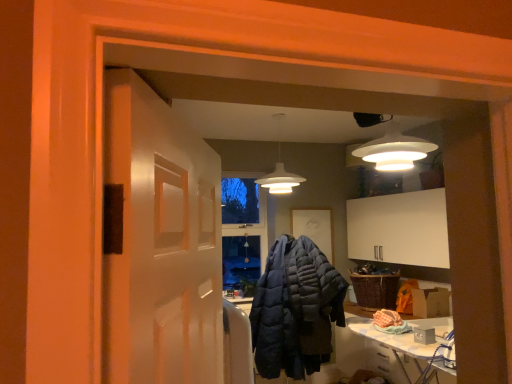
Question: Is white ironing board at lower right not close to woven brown basket at lower right?

Choices:
 (A) yes
 (B) no

Answer: (B)

Question: Can you confirm if white ironing board at lower right is positioned to the right of woven brown basket at lower right?

Choices:
 (A) no
 (B) yes

Answer: (B)

Question: Considering the relative sizes of white ironing board at lower right and woven brown basket at lower right in the image provided, is white ironing board at lower right bigger than woven brown basket at lower right?

Choices:
 (A) yes
 (B) no

Answer: (A)

Question: From the image's perspective, does white ironing board at lower right appear higher than woven brown basket at lower right?

Choices:
 (A) no
 (B) yes

Answer: (A)

Question: Does white ironing board at lower right turn towards woven brown basket at lower right?

Choices:
 (A) no
 (B) yes

Answer: (A)

Question: Is white ironing board at lower right directly adjacent to woven brown basket at lower right?

Choices:
 (A) no
 (B) yes

Answer: (A)

Question: Is dark blue quilted jacket at center bigger than woven brown basket at lower right?

Choices:
 (A) no
 (B) yes

Answer: (B)

Question: Is dark blue quilted jacket at center smaller than woven brown basket at lower right?

Choices:
 (A) yes
 (B) no

Answer: (B)

Question: Can you see dark blue quilted jacket at center touching woven brown basket at lower right?

Choices:
 (A) yes
 (B) no

Answer: (B)

Question: Considering the relative sizes of dark blue quilted jacket at center and woven brown basket at lower right in the image provided, is dark blue quilted jacket at center taller than woven brown basket at lower right?

Choices:
 (A) no
 (B) yes

Answer: (B)

Question: Is dark blue quilted jacket at center looking in the opposite direction of woven brown basket at lower right?

Choices:
 (A) no
 (B) yes

Answer: (A)

Question: From the image's perspective, would you say dark blue quilted jacket at center is shown under woven brown basket at lower right?

Choices:
 (A) no
 (B) yes

Answer: (B)

Question: Is dark blue quilted jacket at center wider than white matte pendant light at center?

Choices:
 (A) yes
 (B) no

Answer: (A)